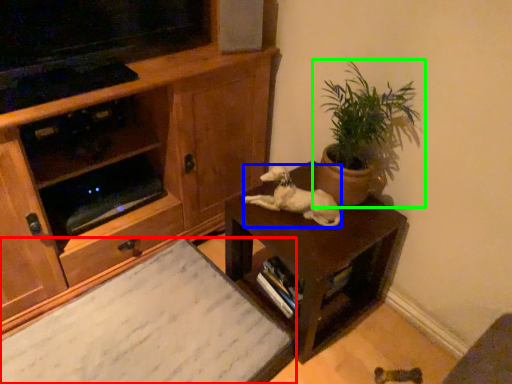
Question: Estimate the real-world distances between objects in this image. Which object is farther from desk (highlighted by a red box), animal (highlighted by a blue box) or houseplant (highlighted by a green box)?

Choices:
 (A) animal
 (B) houseplant

Answer: (B)